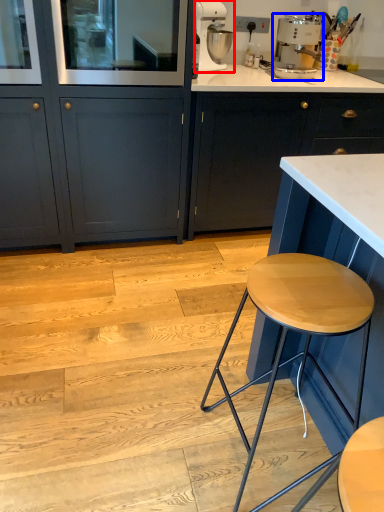
Question: Which object is further to the camera taking this photo, kitchen appliance (highlighted by a red box) or home appliance (highlighted by a blue box)?

Choices:
 (A) kitchen appliance
 (B) home appliance

Answer: (A)